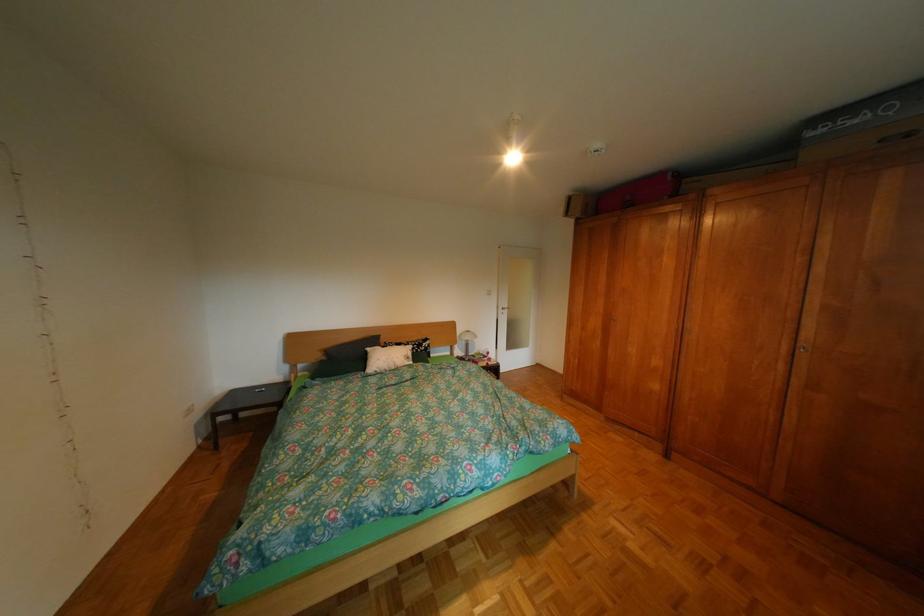
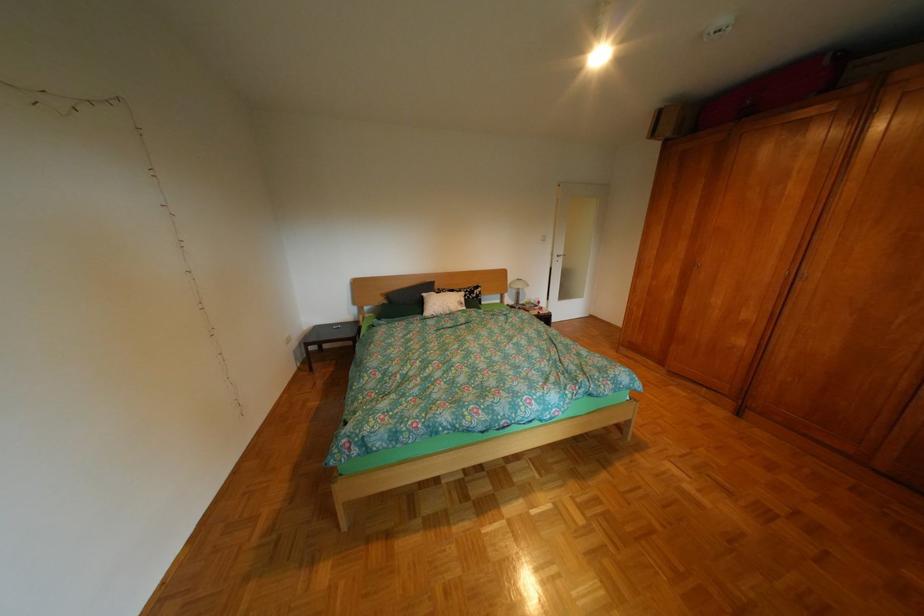
Where in the second image is the point corresponding to pixel 581 215 from the first image?

(667, 136)